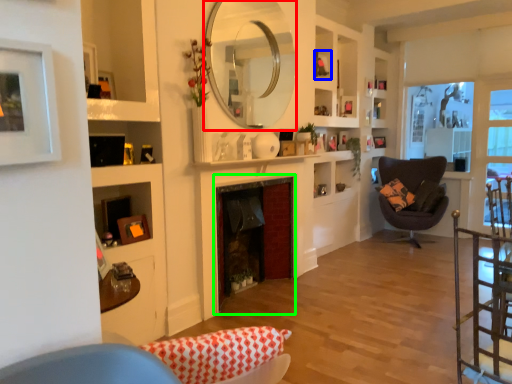
Question: Considering the real-world distances, which object is closest to mirror (highlighted by a red box)? picture frame (highlighted by a blue box) or fireplace (highlighted by a green box).

Choices:
 (A) picture frame
 (B) fireplace

Answer: (B)